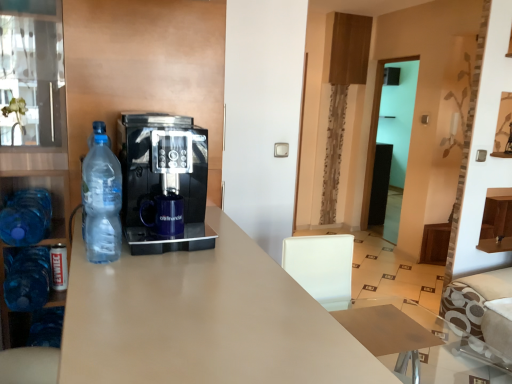
Where is `free spot above matte beige desk at center (from a real-world perspective)`? This screenshot has height=384, width=512. free spot above matte beige desk at center (from a real-world perspective) is located at coordinates (190, 293).